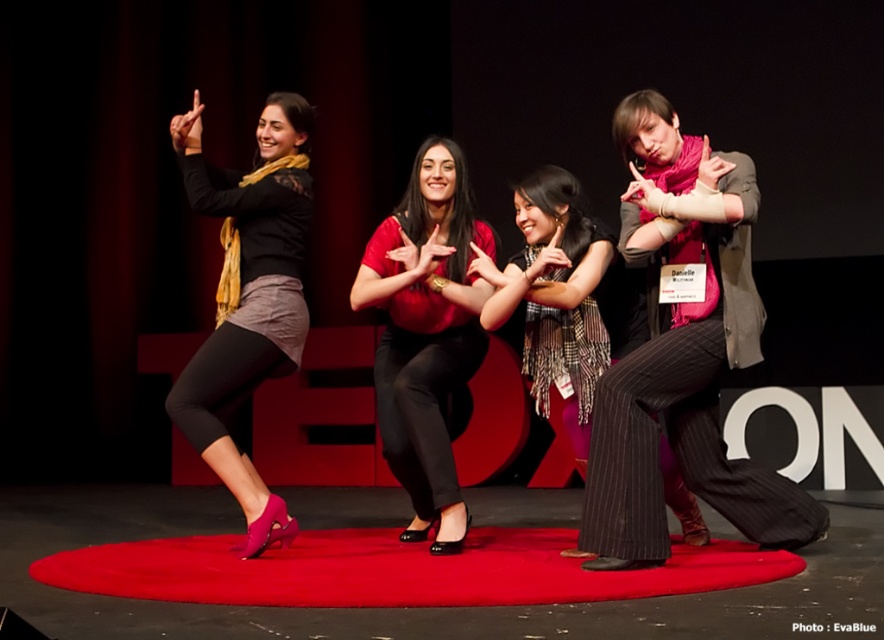
Question: Which object is closer to the camera taking this photo?

Choices:
 (A) plaid scarf at center
 (B) matte red blouse at center
 (C) matte black skirt at left
 (D) rubberized red carpet at center

Answer: (D)

Question: Among these objects, which one is nearest to the camera?

Choices:
 (A) matte black skirt at left
 (B) plaid scarf at center
 (C) matte red blouse at center
 (D) rubberized red carpet at center

Answer: (D)

Question: Does matte black skirt at left have a greater width compared to plaid scarf at center?

Choices:
 (A) no
 (B) yes

Answer: (A)

Question: In this image, where is rubberized red carpet at center located relative to plaid scarf at center?

Choices:
 (A) left
 (B) right

Answer: (A)

Question: Is matte black skirt at left in front of matte red blouse at center?

Choices:
 (A) no
 (B) yes

Answer: (B)

Question: Which of these objects is positioned closest to the rubberized red carpet at center?

Choices:
 (A) matte black skirt at left
 (B) matte red blouse at center
 (C) plaid scarf at center

Answer: (B)